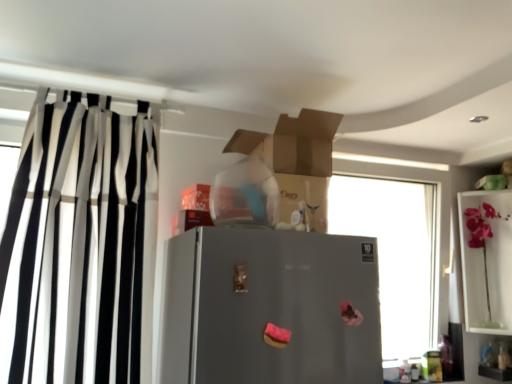
Question: Can you confirm if pink glass vase at upper right is taller than black and white striped curtain at left?

Choices:
 (A) yes
 (B) no

Answer: (B)

Question: From the image's perspective, is pink glass vase at upper right beneath black and white striped curtain at left?

Choices:
 (A) yes
 (B) no

Answer: (A)

Question: From a real-world perspective, is pink glass vase at upper right positioned over black and white striped curtain at left based on gravity?

Choices:
 (A) no
 (B) yes

Answer: (A)

Question: Is pink glass vase at upper right bigger than black and white striped curtain at left?

Choices:
 (A) no
 (B) yes

Answer: (A)

Question: Does pink glass vase at upper right have a smaller size compared to black and white striped curtain at left?

Choices:
 (A) yes
 (B) no

Answer: (A)

Question: In the image, is transparent glass window at center on the left side or the right side of black and white striped curtain at left?

Choices:
 (A) right
 (B) left

Answer: (A)

Question: Considering the positions of transparent glass window at center and black and white striped curtain at left in the image, is transparent glass window at center wider or thinner than black and white striped curtain at left?

Choices:
 (A) wide
 (B) thin

Answer: (B)

Question: Is point (347, 198) closer or farther from the camera than point (121, 198)?

Choices:
 (A) farther
 (B) closer

Answer: (A)

Question: Considering the positions of transparent glass window at center and black and white striped curtain at left in the image, is transparent glass window at center taller or shorter than black and white striped curtain at left?

Choices:
 (A) short
 (B) tall

Answer: (A)

Question: Is black and white striped curtain at left taller or shorter than pink glass vase at upper right?

Choices:
 (A) short
 (B) tall

Answer: (B)

Question: Is point (153, 135) positioned closer to the camera than point (462, 216)?

Choices:
 (A) farther
 (B) closer

Answer: (B)

Question: From a real-world perspective, is black and white striped curtain at left physically located above or below pink glass vase at upper right?

Choices:
 (A) below
 (B) above

Answer: (B)

Question: Is black and white striped curtain at left in front of or behind pink glass vase at upper right in the image?

Choices:
 (A) behind
 (B) front

Answer: (B)

Question: Is transparent glass window at center situated inside pink glass vase at upper right or outside?

Choices:
 (A) inside
 (B) outside

Answer: (B)

Question: Considering their positions, is transparent glass window at center located in front of or behind pink glass vase at upper right?

Choices:
 (A) behind
 (B) front

Answer: (B)